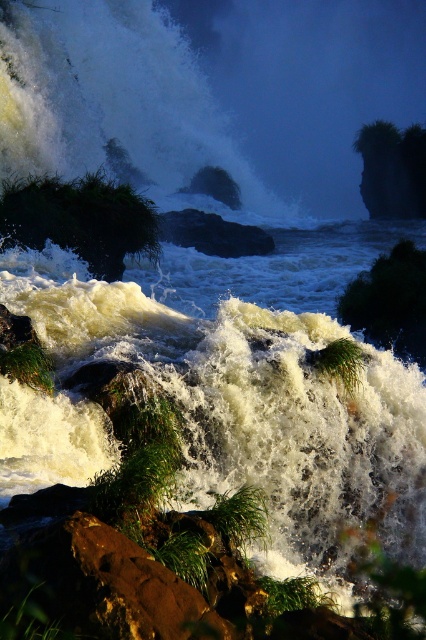
You are a hiker trying to cross the rocky terrain near the waterfall. You see the green grassy bush at left and the green leafy tree at lower right. Which one would you choose to step on if you want to avoid the slippery rocks?

The green grassy bush at left might be wider than the green leafy tree at lower right, so stepping on the green grassy bush at left would provide a more stable footing compared to the narrower area around the green leafy tree at lower right.

You are a photographer trying to capture the waterfall scene. You notice the white frothy water at upper left and the green grassy bush at left. Which object appears taller in the image?

The white frothy water at upper left appears taller than the green grassy bush at left in the image.

You are a photographer positioned at the center of the scene. You want to capture a closeup shot of the white frothy water at upper left. Based on its coordinates, is it within your camera frame that covers from point 0.1 to 0.3 on the horizontal axis and 0.2 to 0.4 on the vertical axis?

The white frothy water at upper left is located at point (117, 100). Since the camera frame covers from 0.1 to 0.3 horizontally and 0.2 to 0.4 vertically, the coordinates fall within the frame. Therefore, the white frothy water at upper left is within the camera frame.